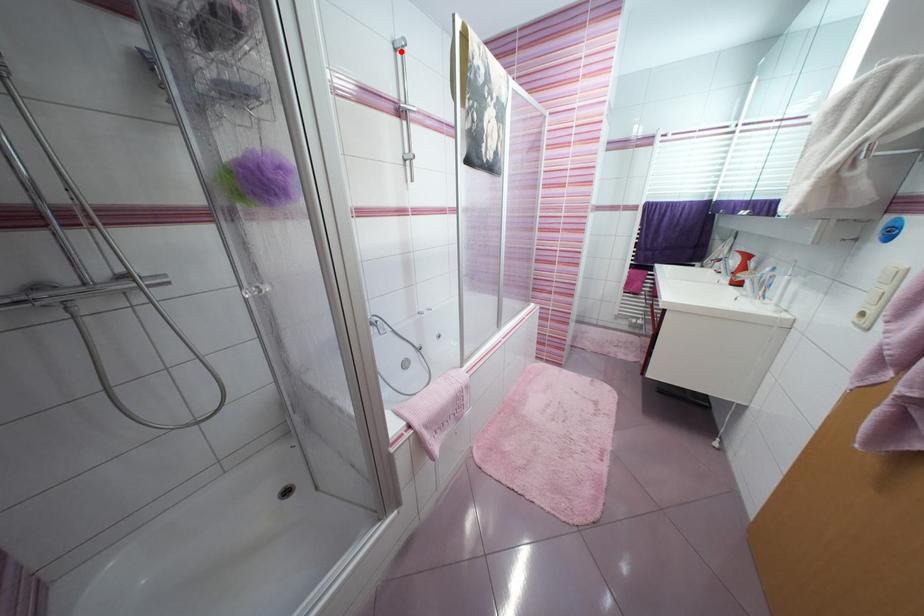
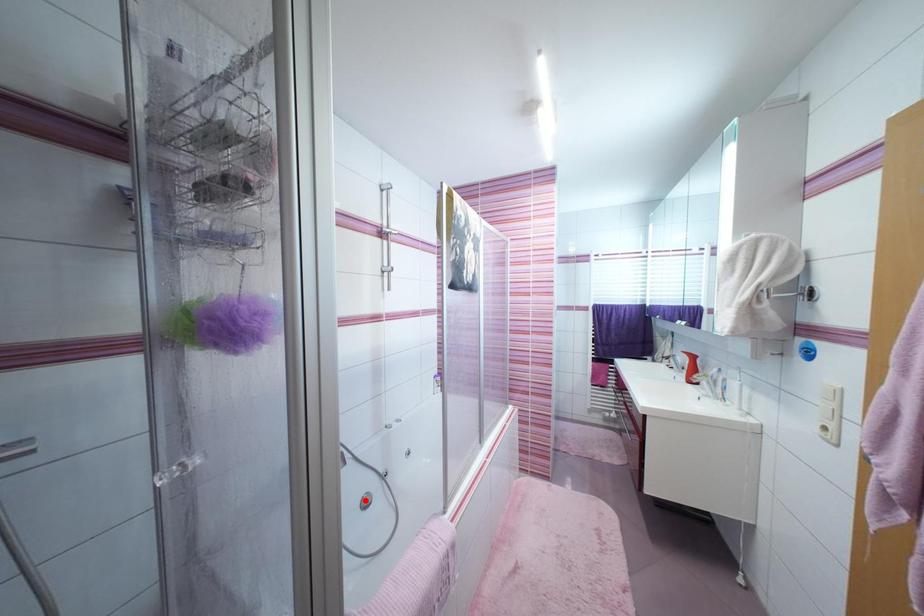
I am providing you with two images of the same scene from different viewpoints. A red point is marked on the first image and another point is marked on the second image. Is the red point in image1 aligned with the point shown in image2?

No